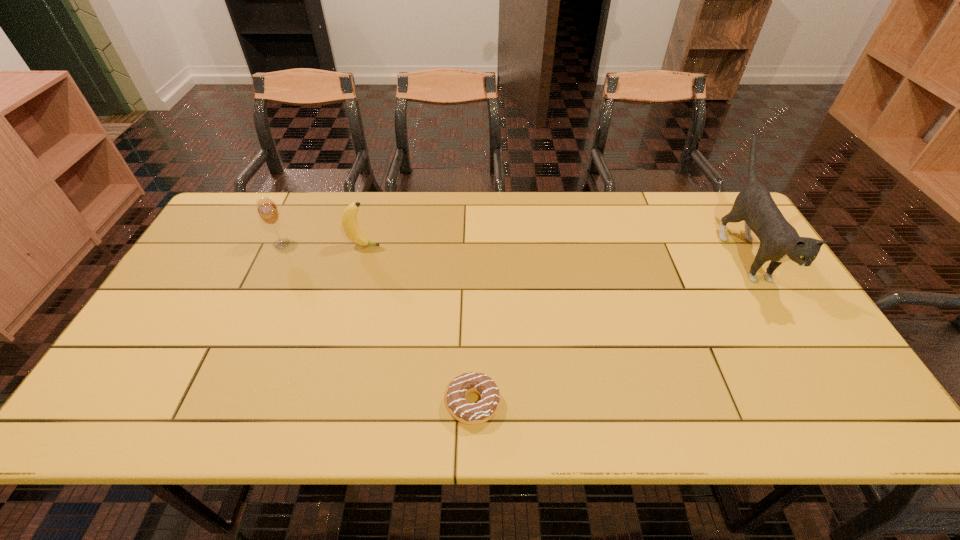
Where is `the rightmost object`? the rightmost object is located at coordinates (779, 241).

The height and width of the screenshot is (540, 960). I want to click on cat, so click(x=779, y=241).

At what (x,y) coordinates should I click in order to perform the action: click on banana. Please return your answer as a coordinate pair (x, y). Image resolution: width=960 pixels, height=540 pixels. Looking at the image, I should click on (349, 217).

Find the location of a particular element. The height and width of the screenshot is (540, 960). the leftmost object is located at coordinates (268, 212).

Find the location of a particular element. the third object from left to right is located at coordinates (462, 410).

At what (x,y) coordinates should I click in order to perform the action: click on doughnut. Please return your answer as a coordinate pair (x, y). Looking at the image, I should click on (462, 410).

The width and height of the screenshot is (960, 540). What are the coordinates of `vacant region located at the face of the rightmost object` in the screenshot? It's located at (797, 339).

Identify the location of vacant space located from the stem of the banana. (429, 246).

The width and height of the screenshot is (960, 540). Identify the location of vacant space located 0.390m on the right of the wineglass. (420, 244).

The height and width of the screenshot is (540, 960). Find the location of `free space located on the back of the third object from left to right`. free space located on the back of the third object from left to right is located at coordinates (474, 303).